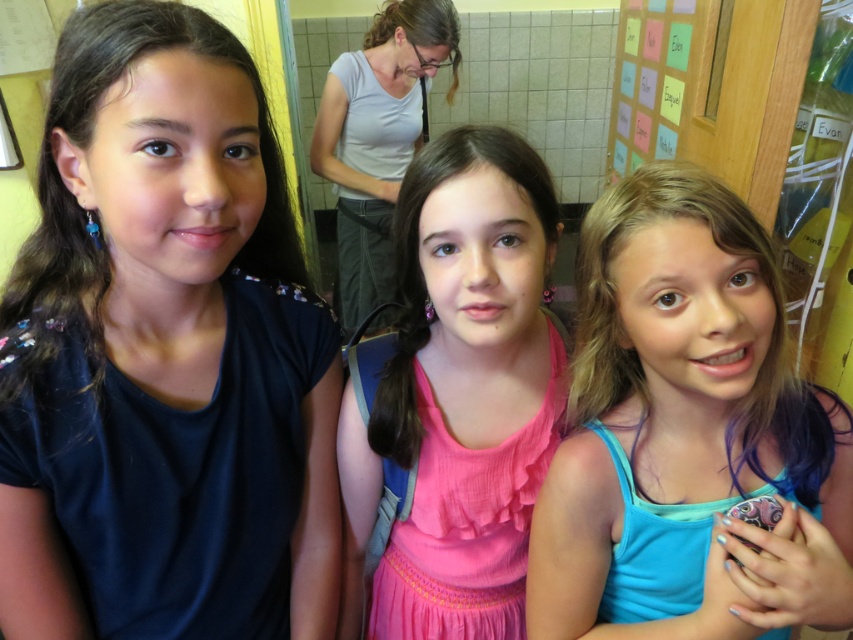
Question: Estimate the real-world distances between objects in this image. Which object is farther from the wooden bulletin board at upper right?

Choices:
 (A) pink chiffon dress at center
 (B) blue fabric shirt at center
 (C) matte gray shirt at upper left

Answer: (A)

Question: Which object appears closest to the camera in this image?

Choices:
 (A) matte gray shirt at upper left
 (B) blue fabric shirt at center
 (C) dark blue fabric shirt at left
 (D) pink chiffon dress at center

Answer: (C)

Question: Which point is farther from the camera taking this photo?

Choices:
 (A) (437, 486)
 (B) (352, 269)
 (C) (844, 572)

Answer: (B)

Question: In this image, where is blue fabric shirt at center located relative to matte gray shirt at upper left?

Choices:
 (A) above
 (B) below

Answer: (B)

Question: Does blue fabric shirt at center have a smaller size compared to pink chiffon dress at center?

Choices:
 (A) yes
 (B) no

Answer: (A)

Question: Is blue fabric shirt at center closer to the viewer compared to matte gray shirt at upper left?

Choices:
 (A) yes
 (B) no

Answer: (A)